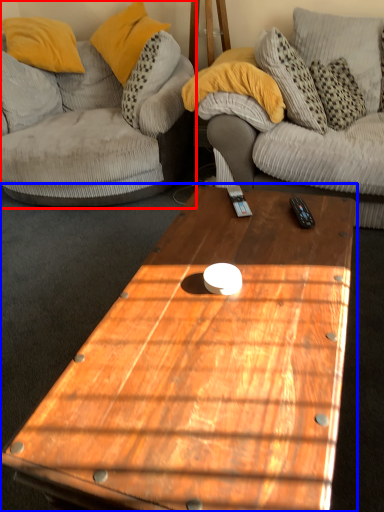
Question: Which object is further to the camera taking this photo, studio couch (highlighted by a red box) or coffee table (highlighted by a blue box)?

Choices:
 (A) studio couch
 (B) coffee table

Answer: (A)